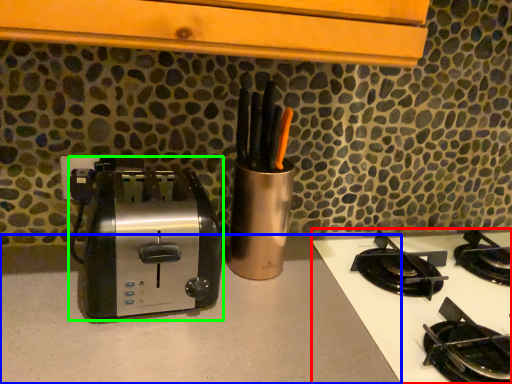
Question: Estimate the real-world distances between objects in this image. Which object is closer to gas stove (highlighted by a red box), counter top (highlighted by a blue box) or toaster (highlighted by a green box)?

Choices:
 (A) counter top
 (B) toaster

Answer: (A)